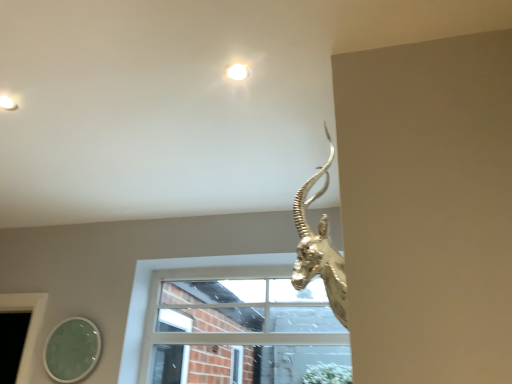
Find the location of a particular element. Image resolution: width=512 pixels, height=384 pixels. gold metallic antelope head at upper right is located at coordinates (319, 247).

Between gold metallic antelope head at upper right and white glass window at center, which one has larger width?

Wider between the two is gold metallic antelope head at upper right.

Between gold metallic antelope head at upper right and white glass window at center, which one has more height?

Standing taller between the two is white glass window at center.

In the scene shown: Is white glass window at center a part of gold metallic antelope head at upper right?

No, white glass window at center is not a part of gold metallic antelope head at upper right.

Where is `window to the left of gold metallic antelope head at upper right`? window to the left of gold metallic antelope head at upper right is located at coordinates (180, 278).

Is white glass window at center far from green glass mirror at lower left?

They are positioned close to each other.

Considering the positions of objects white glass window at center and green glass mirror at lower left in the image provided, who is more to the left, white glass window at center or green glass mirror at lower left?

green glass mirror at lower left is more to the left.

In the scene shown: Which object is thinner, white glass window at center or green glass mirror at lower left?

green glass mirror at lower left.

How different are the orientations of white glass window at center and green glass mirror at lower left in degrees?

They differ by 0.358 degrees in their facing directions.

In order to click on animal above the green glass mirror at lower left (from the image's perspective) in this screenshot , I will do `click(319, 247)`.

Choose the correct answer: Is gold metallic antelope head at upper right inside green glass mirror at lower left or outside it?

The correct answer is: outside.

Considering the sizes of gold metallic antelope head at upper right and green glass mirror at lower left in the image, is gold metallic antelope head at upper right bigger or smaller than green glass mirror at lower left?

gold metallic antelope head at upper right is bigger than green glass mirror at lower left.

How different are the orientations of white glass window at center and gold metallic antelope head at upper right in degrees?

The angle between the facing direction of white glass window at center and the facing direction of gold metallic antelope head at upper right is 90.2 degrees.

From a real-world perspective, between white glass window at center and gold metallic antelope head at upper right, who is vertically higher?

gold metallic antelope head at upper right.

Is white glass window at center not near gold metallic antelope head at upper right?

Yes.

Would you say white glass window at center is inside or outside gold metallic antelope head at upper right?

white glass window at center is outside gold metallic antelope head at upper right.

Is green glass mirror at lower left facing away from gold metallic antelope head at upper right?

No.

Considering the relative positions of green glass mirror at lower left and gold metallic antelope head at upper right in the image provided, is green glass mirror at lower left to the left of gold metallic antelope head at upper right from the viewer's perspective?

Correct, you'll find green glass mirror at lower left to the left of gold metallic antelope head at upper right.

Is green glass mirror at lower left in contact with gold metallic antelope head at upper right?

No, green glass mirror at lower left is not touching gold metallic antelope head at upper right.

Is green glass mirror at lower left outside of white glass window at center?

Yes, green glass mirror at lower left is not within white glass window at center.

Is point (75, 359) positioned in front of point (253, 264)?

Yes, point (75, 359) is in front of point (253, 264).

From a real-world perspective, is green glass mirror at lower left below white glass window at center?

Indeed, from a real-world perspective, green glass mirror at lower left is positioned beneath white glass window at center.

Between green glass mirror at lower left and white glass window at center, which one appears on the left side from the viewer's perspective?

From the viewer's perspective, green glass mirror at lower left appears more on the left side.

Locate an element on the screen. animal located above the white glass window at center (from the image's perspective) is located at coordinates [x=319, y=247].

Locate an element on the screen. The width and height of the screenshot is (512, 384). mirror on the left of the white glass window at center is located at coordinates (72, 350).

Based on their spatial positions, is white glass window at center or gold metallic antelope head at upper right closer to green glass mirror at lower left?

white glass window at center lies closer to green glass mirror at lower left than the other object.

Based on their spatial positions, is green glass mirror at lower left or white glass window at center closer to gold metallic antelope head at upper right?

Among the two, white glass window at center is located nearer to gold metallic antelope head at upper right.

When comparing their distances from gold metallic antelope head at upper right, does white glass window at center or green glass mirror at lower left seem further?

green glass mirror at lower left lies further to gold metallic antelope head at upper right than the other object.

From the image, which object appears to be farther from white glass window at center, green glass mirror at lower left or gold metallic antelope head at upper right?

gold metallic antelope head at upper right is further to white glass window at center.

Estimate the real-world distances between objects in this image. Which object is closer to white glass window at center, gold metallic antelope head at upper right or green glass mirror at lower left?

green glass mirror at lower left.

From the image, which object appears to be farther from green glass mirror at lower left, gold metallic antelope head at upper right or white glass window at center?

Among the two, gold metallic antelope head at upper right is located further to green glass mirror at lower left.

I want to click on window positioned between gold metallic antelope head at upper right and green glass mirror at lower left from near to far, so click(x=180, y=278).